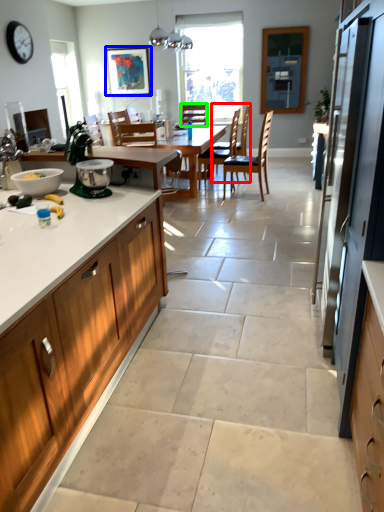
Question: Estimate the real-world distances between objects in this image. Which object is farther from chair (highlighted by a red box), picture frame (highlighted by a blue box) or chair (highlighted by a green box)?

Choices:
 (A) picture frame
 (B) chair

Answer: (A)